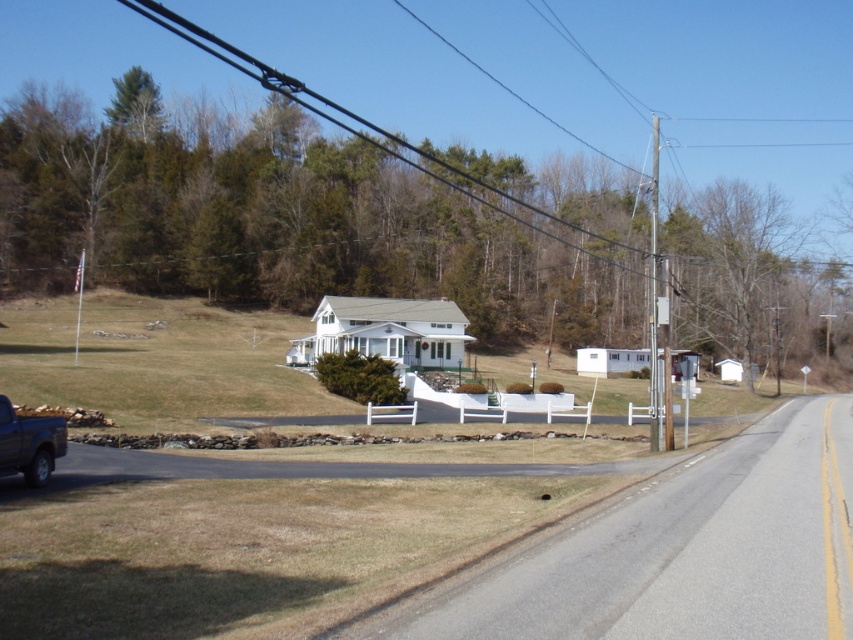
Question: Is black wire at upper center behind dark gray metallic truck at lower left?

Choices:
 (A) no
 (B) yes

Answer: (B)

Question: Does black wire at upper center have a greater width compared to dark gray metallic truck at lower left?

Choices:
 (A) no
 (B) yes

Answer: (B)

Question: Among these objects, which one is nearest to the camera?

Choices:
 (A) black wire at upper center
 (B) dark gray metallic truck at lower left

Answer: (B)

Question: Among these objects, which one is nearest to the camera?

Choices:
 (A) dark gray metallic truck at lower left
 (B) black wire at upper center

Answer: (A)

Question: Is black wire at upper center closer to the viewer compared to dark gray metallic truck at lower left?

Choices:
 (A) no
 (B) yes

Answer: (A)